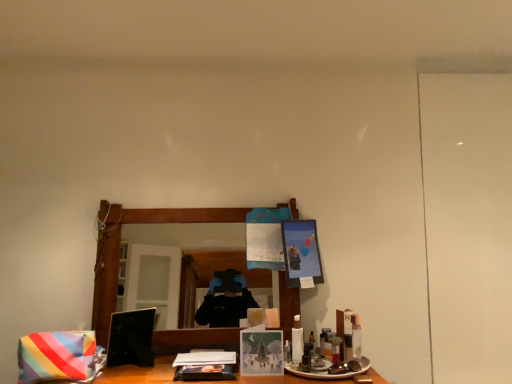
Question: From the image's perspective, is white plastic bottle at center, the 2th toiletry positioned from the right, under matte black picture frame at upper center, which is the 1th picture frame in back-to-front order?

Choices:
 (A) no
 (B) yes

Answer: (B)

Question: Does white plastic bottle at center, positioned as the first toiletry in left-to-right order, have a lesser height compared to matte black picture frame at upper center, which is the 1th picture frame in back-to-front order?

Choices:
 (A) no
 (B) yes

Answer: (B)

Question: Considering the relative positions of white plastic bottle at center, positioned as the first toiletry in left-to-right order, and matte black picture frame at upper center, positioned as the second picture frame in left-to-right order, in the image provided, is white plastic bottle at center, positioned as the first toiletry in left-to-right order, to the right of matte black picture frame at upper center, positioned as the second picture frame in left-to-right order, from the viewer's perspective?

Choices:
 (A) no
 (B) yes

Answer: (A)

Question: Considering the relative sizes of white plastic bottle at center, the 2th toiletry positioned from the right, and matte black picture frame at upper center, positioned as the second picture frame in left-to-right order, in the image provided, is white plastic bottle at center, the 2th toiletry positioned from the right, bigger than matte black picture frame at upper center, positioned as the second picture frame in left-to-right order,?

Choices:
 (A) yes
 (B) no

Answer: (B)

Question: Considering the relative positions of white plastic bottle at center, positioned as the first toiletry in left-to-right order, and matte black picture frame at upper center, which is the 1th picture frame in back-to-front order, in the image provided, is white plastic bottle at center, positioned as the first toiletry in left-to-right order, behind matte black picture frame at upper center, which is the 1th picture frame in back-to-front order,?

Choices:
 (A) yes
 (B) no

Answer: (B)

Question: In the image, is white plastic bottle at center, positioned as the first toiletry in left-to-right order, on the left side or the right side of clear plastic bottle at lower right, which is the second toiletry in left-to-right order?

Choices:
 (A) right
 (B) left

Answer: (B)

Question: From their relative heights in the image, would you say white plastic bottle at center, positioned as the first toiletry in left-to-right order, is taller or shorter than clear plastic bottle at lower right, marked as the 1th toiletry in a right-to-left arrangement?

Choices:
 (A) tall
 (B) short

Answer: (A)

Question: Based on their sizes in the image, would you say white plastic bottle at center, positioned as the first toiletry in left-to-right order, is bigger or smaller than clear plastic bottle at lower right, which is the second toiletry in left-to-right order?

Choices:
 (A) big
 (B) small

Answer: (A)

Question: Is white plastic bottle at center, the 2th toiletry positioned from the right, wider or thinner than clear plastic bottle at lower right, which is the second toiletry in left-to-right order?

Choices:
 (A) thin
 (B) wide

Answer: (B)

Question: Considering the positions of point (297, 334) and point (267, 336), is point (297, 334) closer or farther from the camera than point (267, 336)?

Choices:
 (A) closer
 (B) farther

Answer: (B)

Question: In the image, is white plastic bottle at center, the 2th toiletry positioned from the right, on the left side or the right side of matte paper card at center, positioned as the 1th picture frame in bottom-to-top order?

Choices:
 (A) right
 (B) left

Answer: (A)

Question: From a real-world perspective, is white plastic bottle at center, the 2th toiletry positioned from the right, physically located above or below matte paper card at center, which is counted as the first picture frame, starting from the left?

Choices:
 (A) below
 (B) above

Answer: (B)

Question: Considering the positions of white plastic bottle at center, the 2th toiletry positioned from the right, and matte paper card at center, arranged as the second picture frame when viewed from the top, in the image, is white plastic bottle at center, the 2th toiletry positioned from the right, wider or thinner than matte paper card at center, arranged as the second picture frame when viewed from the top,?

Choices:
 (A) wide
 (B) thin

Answer: (B)

Question: Considering the positions of rainbow striped fabric at lower left and matte black picture frame at upper center, which is counted as the 2th picture frame, starting from the bottom, in the image, is rainbow striped fabric at lower left taller or shorter than matte black picture frame at upper center, which is counted as the 2th picture frame, starting from the bottom,?

Choices:
 (A) short
 (B) tall

Answer: (A)

Question: Which is correct: rainbow striped fabric at lower left is inside matte black picture frame at upper center, the first picture frame positioned from the right, or outside of it?

Choices:
 (A) outside
 (B) inside

Answer: (A)